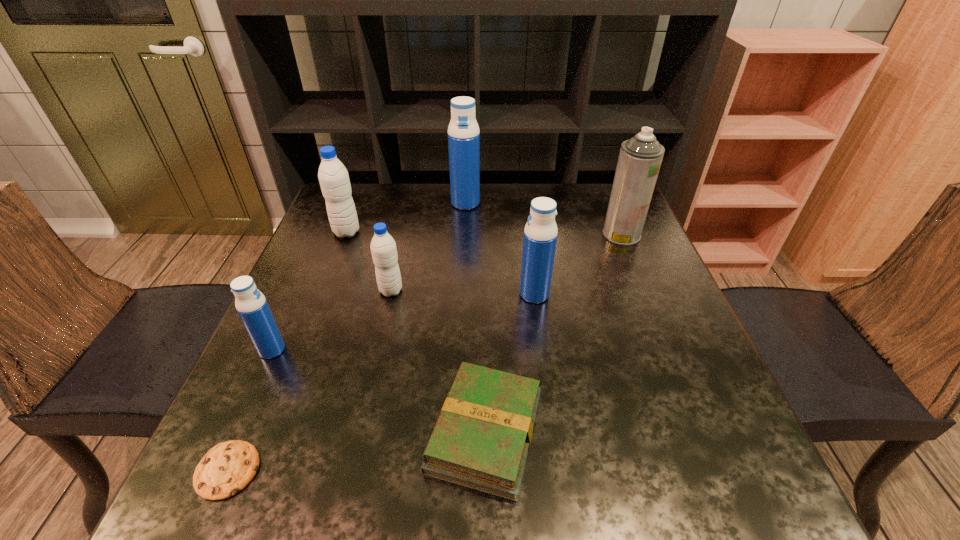
At what (x,y) coordinates should I click in order to perform the action: click on the smallest blue water bottle. Please return your answer as a coordinate pair (x, y). Looking at the image, I should click on (254, 311).

I want to click on book, so click(x=481, y=439).

Find the location of `the second shortest object`. the second shortest object is located at coordinates (481, 439).

This screenshot has height=540, width=960. Identify the location of cookie. click(x=227, y=468).

The width and height of the screenshot is (960, 540). In order to click on vacant area situated on the front of the farthest blue water bottle in this screenshot , I will do `click(463, 266)`.

The image size is (960, 540). Identify the location of vacant space located 0.390m on the front of the rightmost object. (677, 368).

Locate an element on the screen. This screenshot has width=960, height=540. free space located on the left of the second biggest blue water bottle is located at coordinates (405, 294).

The image size is (960, 540). Identify the location of vacant area situated on the right of the farther gray water bottle. (468, 232).

Where is `vacant area situated 0.230m on the right of the third water bottle from left to right`? The image size is (960, 540). vacant area situated 0.230m on the right of the third water bottle from left to right is located at coordinates (503, 291).

I want to click on vacant space located 0.290m on the front of the nearest blue water bottle, so click(x=196, y=517).